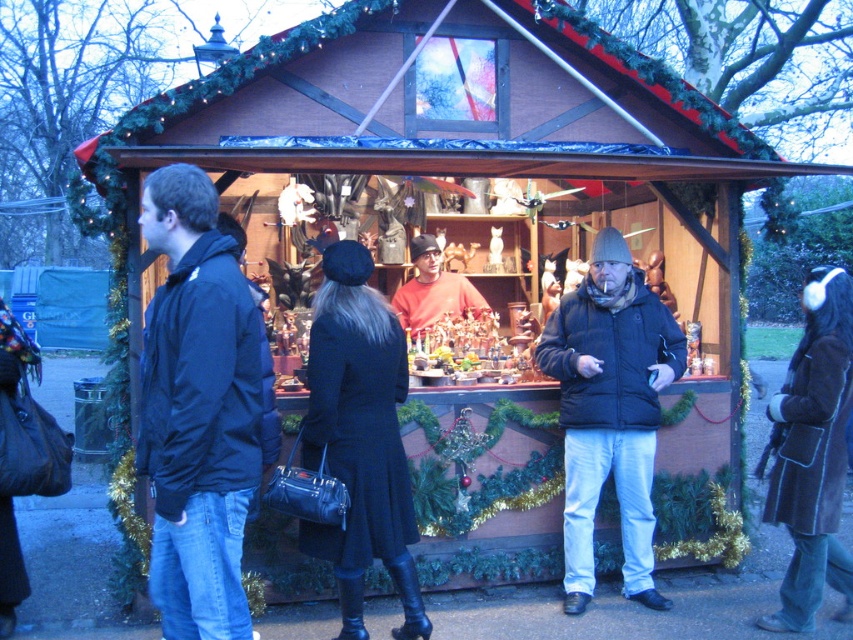
You are a customer at the market stall and want to buy both the black matte jacket at center and the matte orange sweater at center. Which item is positioned lower on your body when worn?

The black matte jacket at center is positioned lower on your body when worn because it is below the matte orange sweater at center.

You are a customer browsing the festive market stall. You see two coats displayed at the stall. The dark blue leather coat at center and the brown suede coat at lower right. Which coat is taller?

The dark blue leather coat at center is taller than the brown suede coat at lower right.